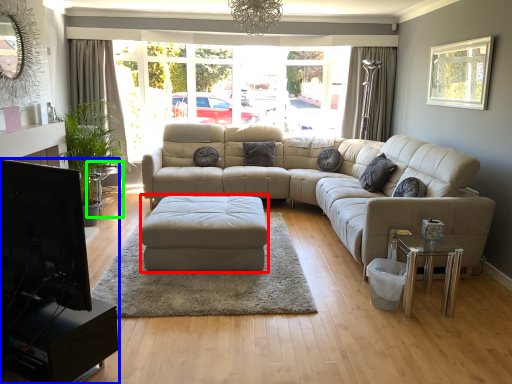
Question: Which object is the farthest from footrest (highlighted by a red box)? Choose among these: entertainment center (highlighted by a blue box) or side table (highlighted by a green box).

Choices:
 (A) entertainment center
 (B) side table

Answer: (B)